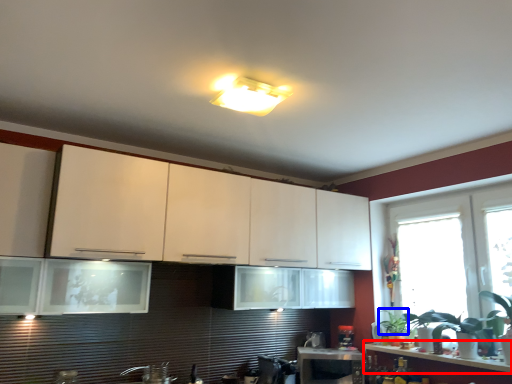
Question: Which object is further to the camera taking this photo, countertop (highlighted by a red box) or plant (highlighted by a blue box)?

Choices:
 (A) countertop
 (B) plant

Answer: (B)